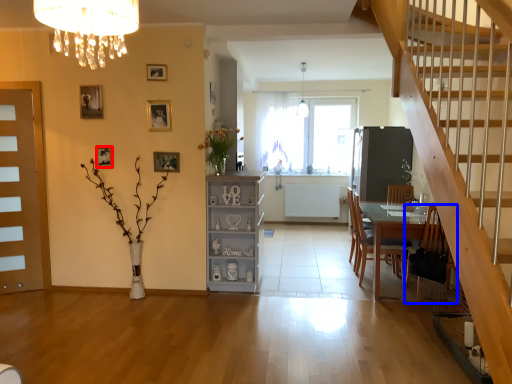
Question: Among these objects, which one is farthest to the camera, picture frame (highlighted by a red box) or chair (highlighted by a blue box)?

Choices:
 (A) picture frame
 (B) chair

Answer: (A)